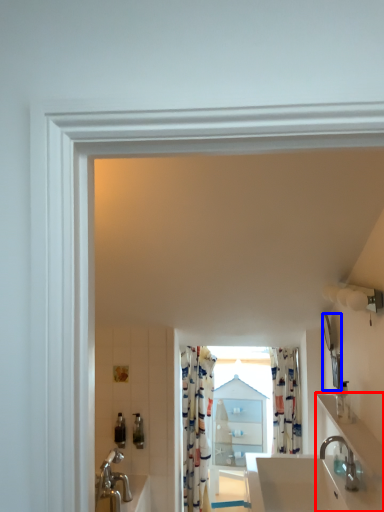
Question: Which point is further to the camera, counter top (highlighted by a red box) or mirror (highlighted by a blue box)?

Choices:
 (A) counter top
 (B) mirror

Answer: (B)